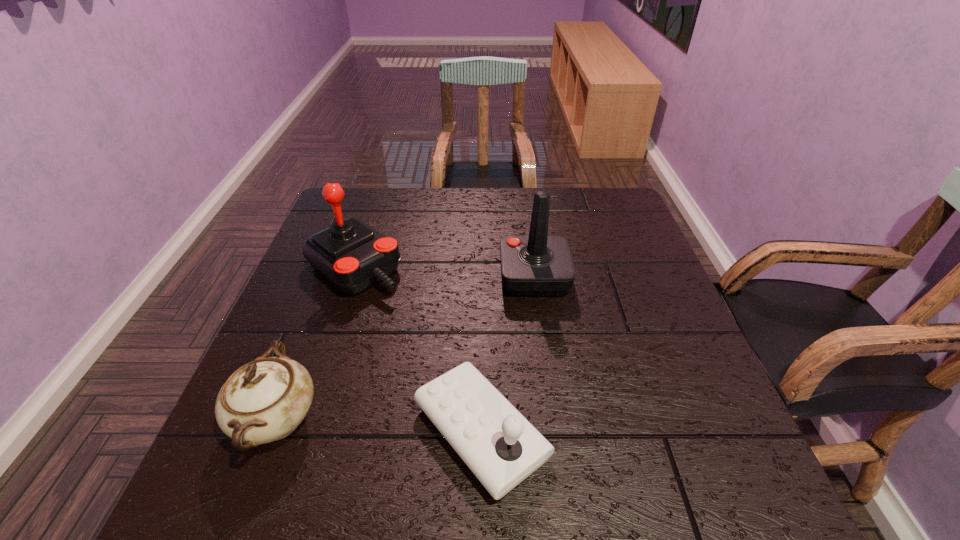
Identify the location of the leftmost joystick. The width and height of the screenshot is (960, 540). (351, 255).

The height and width of the screenshot is (540, 960). In order to click on chinaware in this screenshot , I will do `click(265, 400)`.

The image size is (960, 540). Identify the location of the shortest object. (500, 446).

In order to click on the nearest joystick in this screenshot , I will do (500, 446).

Locate an element on the screen. free region located on the front of the leftmost joystick is located at coordinates (303, 422).

Image resolution: width=960 pixels, height=540 pixels. I want to click on vacant space positioned on the right of the second shortest object, so click(x=437, y=420).

This screenshot has width=960, height=540. Find the location of `vacant point located on the left of the shortest object`. vacant point located on the left of the shortest object is located at coordinates (362, 432).

Where is `chinaware at the near edge`? chinaware at the near edge is located at coordinates (265, 400).

The width and height of the screenshot is (960, 540). In order to click on joystick that is at the near edge in this screenshot , I will do `click(500, 446)`.

Locate an element on the screen. joystick at the left edge is located at coordinates (351, 255).